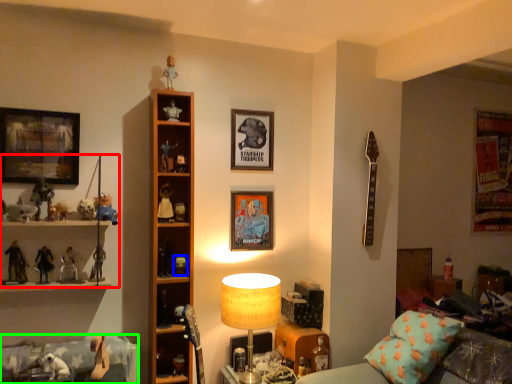
Question: Estimate the real-world distances between objects in this image. Which object is farther from collection (highlighted by a red box), toy (highlighted by a blue box) or bed frame (highlighted by a green box)?

Choices:
 (A) toy
 (B) bed frame

Answer: (A)